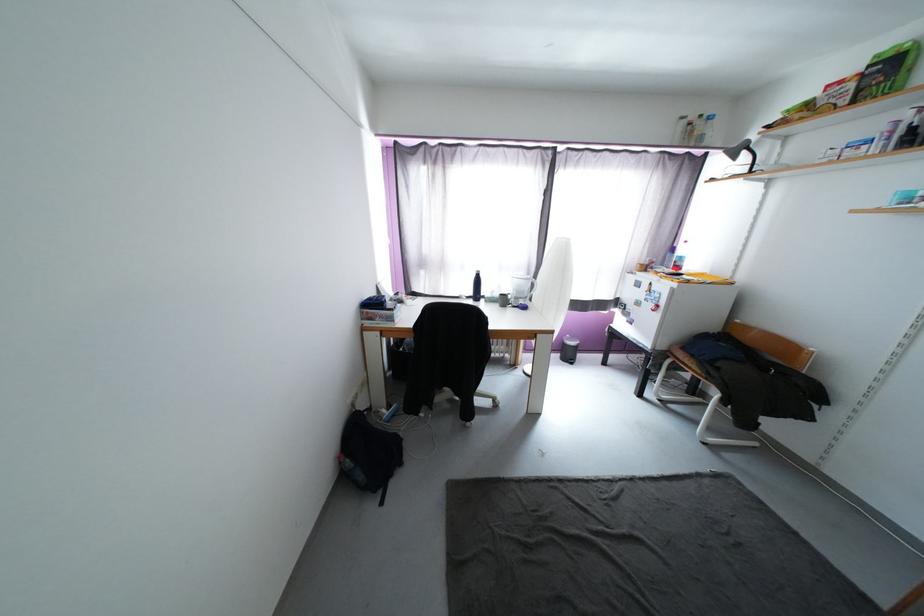
Where is `black desk lamp`? Image resolution: width=924 pixels, height=616 pixels. black desk lamp is located at coordinates (742, 153).